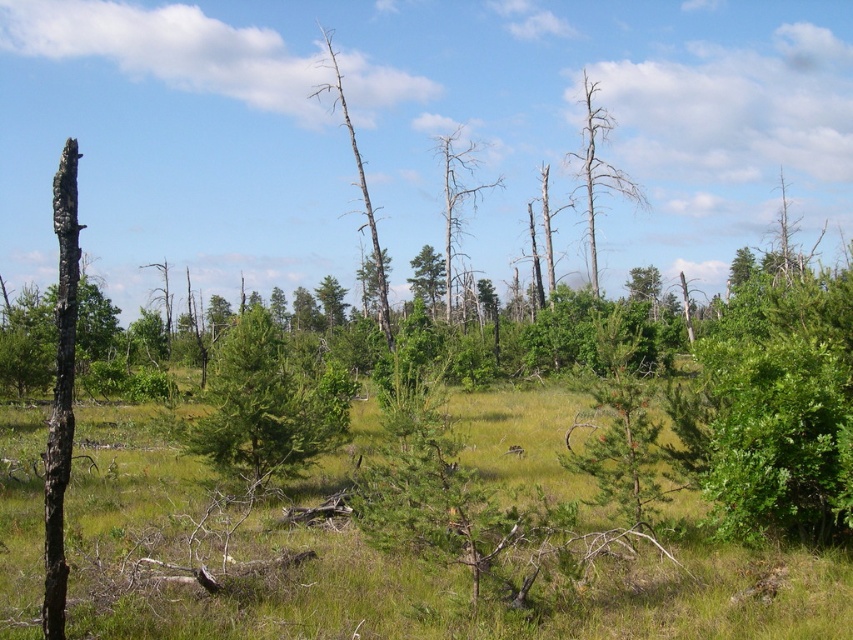
Consider the image. You are a hiker trying to navigate through the forest. You notice two trees at the center of your view, the green matte tree at center and the dead wood tree at center. Which tree is smaller in size?

The green matte tree at center is smaller in size compared to the dead wood tree at center according to the description.

You are a hiker who wants to take a photo of the green matte tree at center and the dead wood tree at upper right. Which tree should you stand closer to in order to capture both in the frame without zooming?

You should stand closer to the green matte tree at center because it is shorter than the dead wood tree at upper right, allowing both to fit in the frame when positioned appropriately.